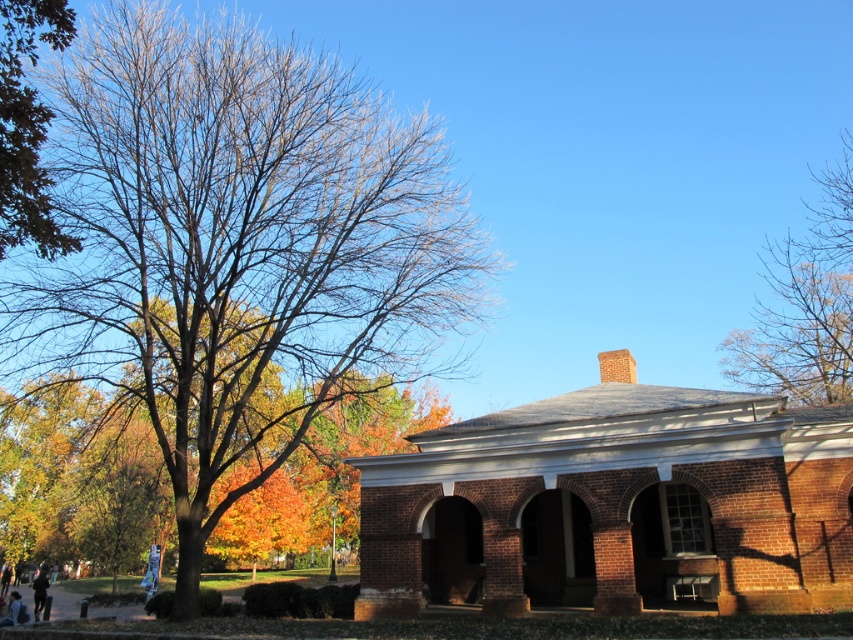
Question: Among these points, which one is farthest from the camera?

Choices:
 (A) (485, 253)
 (B) (90, 404)

Answer: (B)

Question: Does bare branches at left have a lesser width compared to green leafy tree at upper left?

Choices:
 (A) yes
 (B) no

Answer: (B)

Question: Among these objects, which one is farthest from the camera?

Choices:
 (A) black fabric person at lower left
 (B) autumn leaves at left

Answer: (A)

Question: Considering the relative positions of bare branches at left and bare branches at upper right in the image provided, where is bare branches at left located with respect to bare branches at upper right?

Choices:
 (A) above
 (B) below

Answer: (B)

Question: Which point is closer to the camera?

Choices:
 (A) blue denim jeans at lower left
 (B) autumn leaves at left

Answer: (B)

Question: Can you confirm if green leafy tree at upper left is bigger than blue denim jeans at lower left?

Choices:
 (A) yes
 (B) no

Answer: (B)